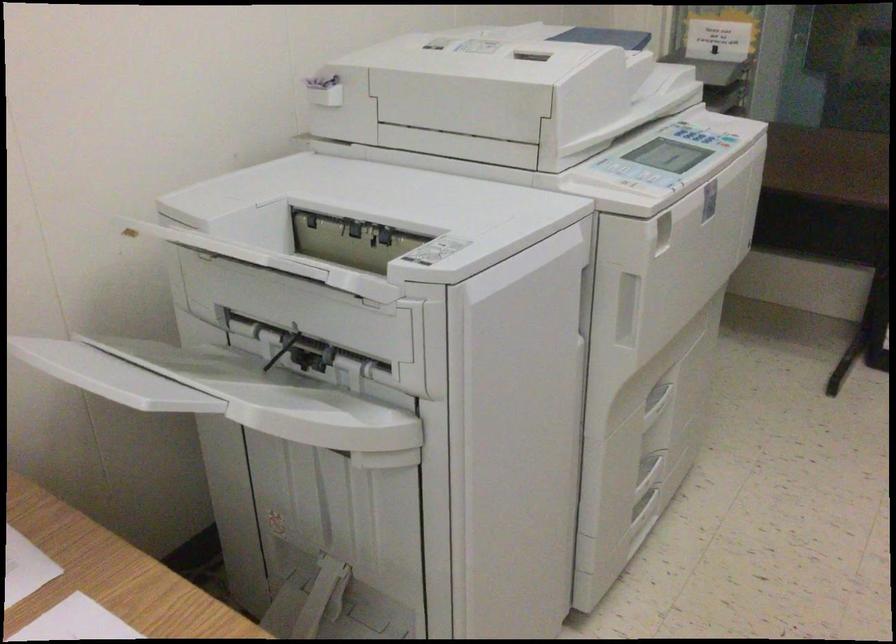
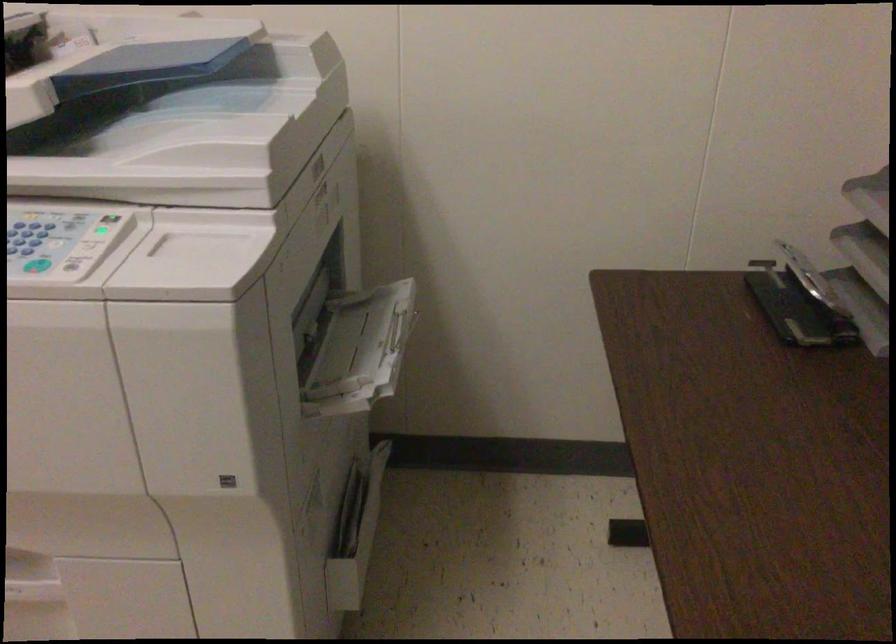
The point at (677,127) is marked in the first image. Where is the corresponding point in the second image?

(107, 228)